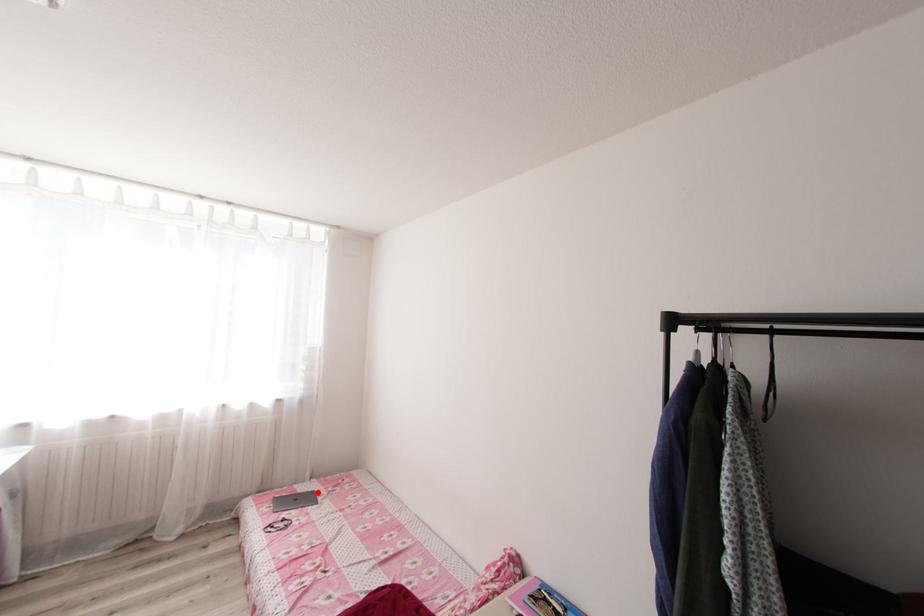
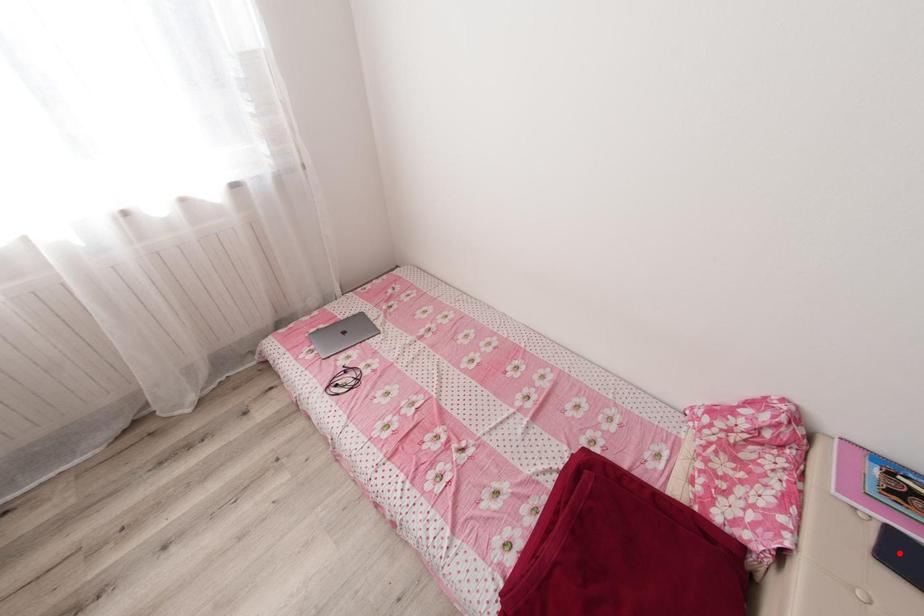
I am providing you with two images of the same scene from different viewpoints. A red point is marked on the first image and another point is marked on the second image. Do the highlighted points in image1 and image2 indicate the same real-world spot?

No